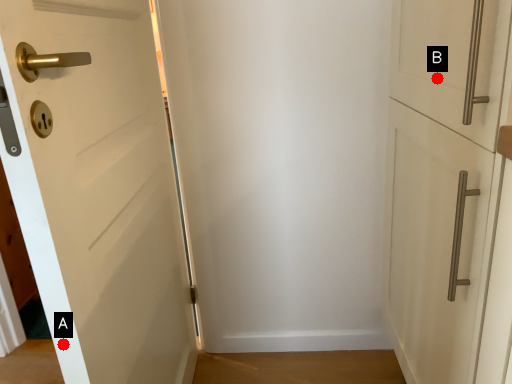
Question: Two points are circled on the image, labeled by A and B beside each circle. Which of the following is the closest to the observer?

Choices:
 (A) A is closer
 (B) B is closer

Answer: (A)